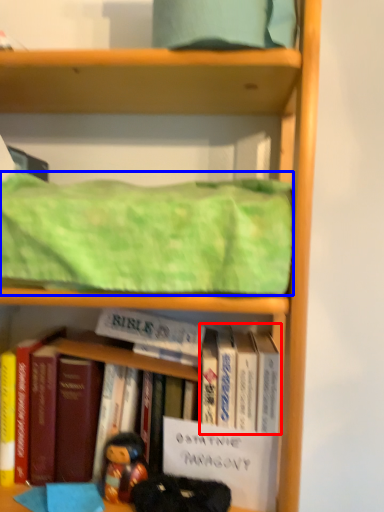
Question: Which of the following is the closest to the observer, book (highlighted by a red box) or blanket (highlighted by a blue box)?

Choices:
 (A) book
 (B) blanket

Answer: (B)